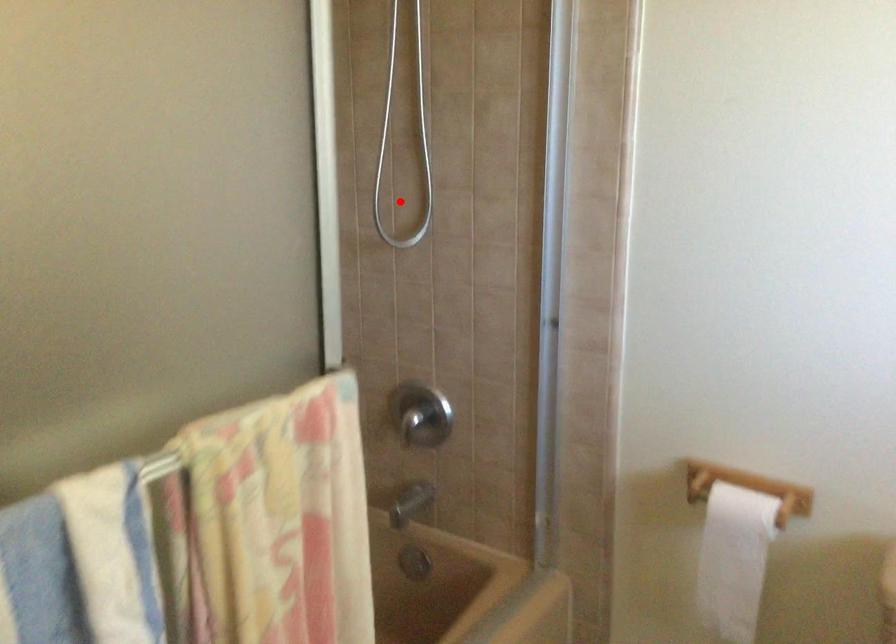
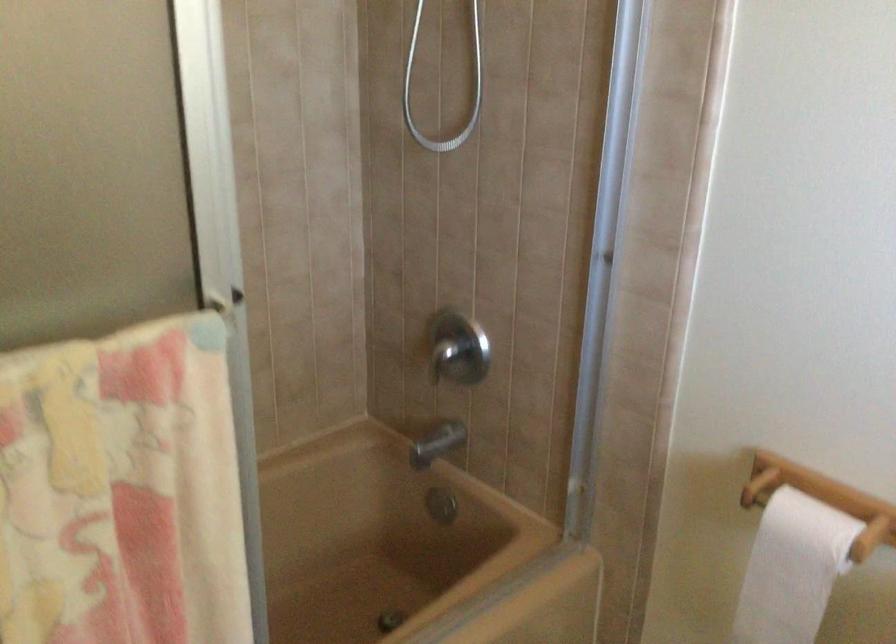
Question: I am providing you with two images of the same scene from different viewpoints. In image1, a red point is highlighted. Considering the same 3D point in image2, which of the following is correct?

Choices:
 (A) It is closer
 (B) It is farther

Answer: (A)